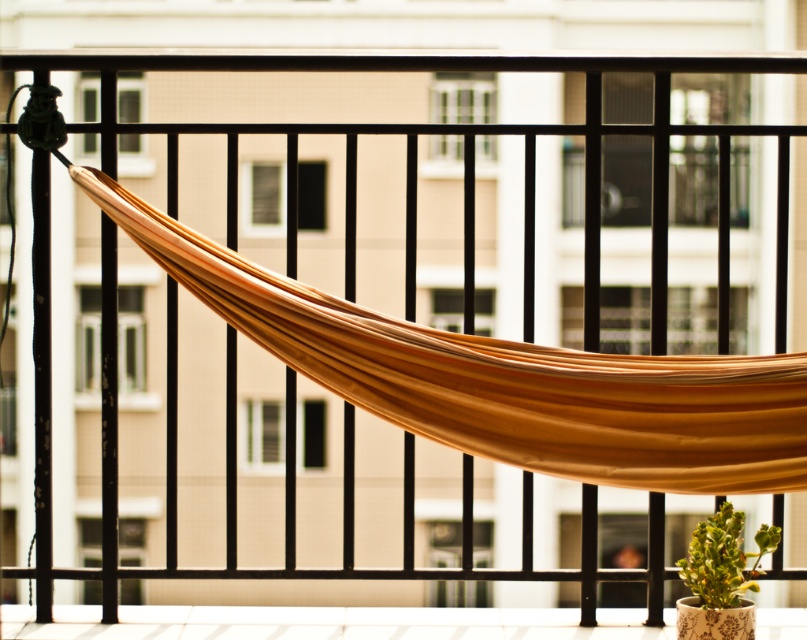
Is brown fabric hammock at center wider than green leafy plant at lower right?

Correct, the width of brown fabric hammock at center exceeds that of green leafy plant at lower right.

Between brown fabric hammock at center and green leafy plant at lower right, which one appears on the left side from the viewer's perspective?

From the viewer's perspective, brown fabric hammock at center appears more on the left side.

Between point (659, 444) and point (705, 595), which one is positioned in front?

Point (659, 444) is in front.

Image resolution: width=807 pixels, height=640 pixels. Find the location of `brown fabric hammock at center`. brown fabric hammock at center is located at coordinates (504, 378).